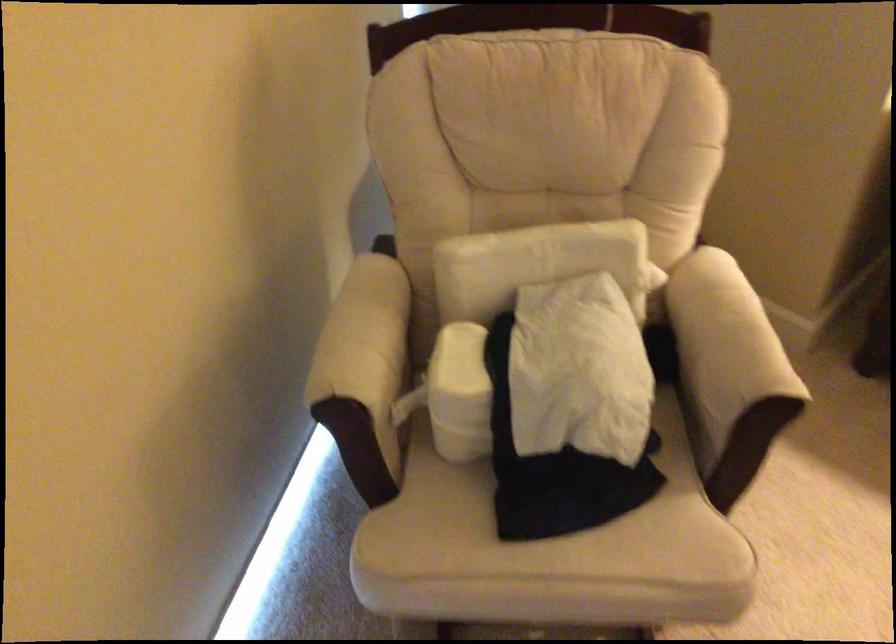
The width and height of the screenshot is (896, 644). Find the location of `white foam cushion`. white foam cushion is located at coordinates (460, 393).